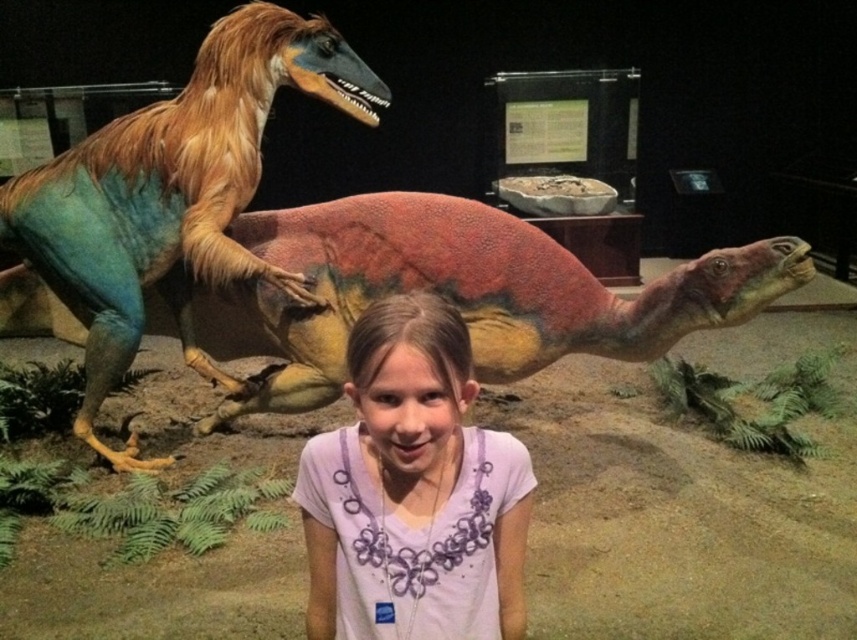
Question: Is multicolored textured dinosaur at center below purple cotton shirt at center?

Choices:
 (A) yes
 (B) no

Answer: (B)

Question: Considering the relative positions of multicolored textured dinosaur at center and purple cotton shirt at center in the image provided, where is multicolored textured dinosaur at center located with respect to purple cotton shirt at center?

Choices:
 (A) below
 (B) above

Answer: (B)

Question: Which point is farther to the camera?

Choices:
 (A) multicolored glossy dinosaur at left
 (B) multicolored textured dinosaur at center

Answer: (A)

Question: Does multicolored textured dinosaur at center appear over purple cotton shirt at center?

Choices:
 (A) yes
 (B) no

Answer: (A)

Question: Which point is farther to the camera?

Choices:
 (A) (384, 280)
 (B) (102, 388)
 (C) (432, 340)

Answer: (B)

Question: Which object appears closest to the camera in this image?

Choices:
 (A) multicolored textured dinosaur at center
 (B) purple cotton shirt at center
 (C) multicolored glossy dinosaur at left

Answer: (B)